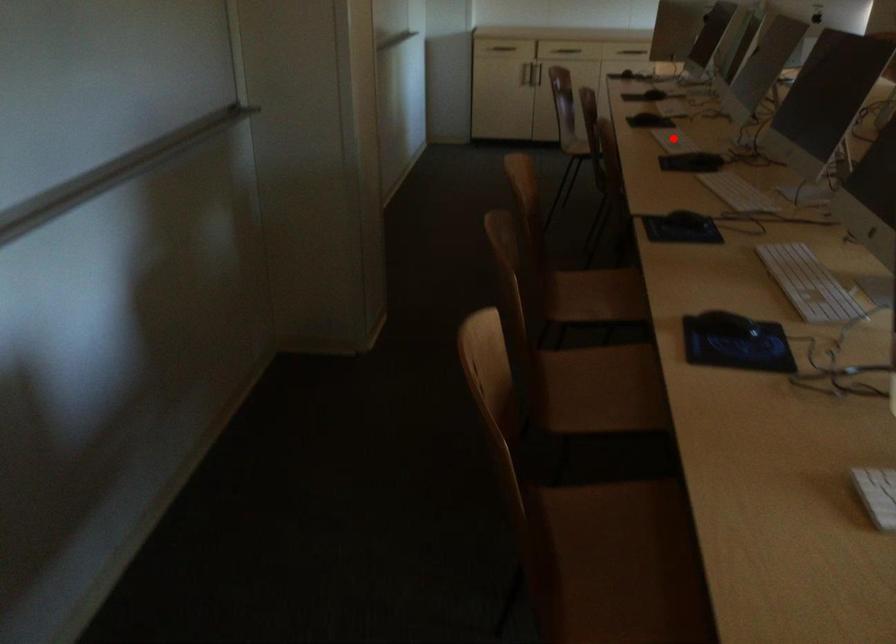
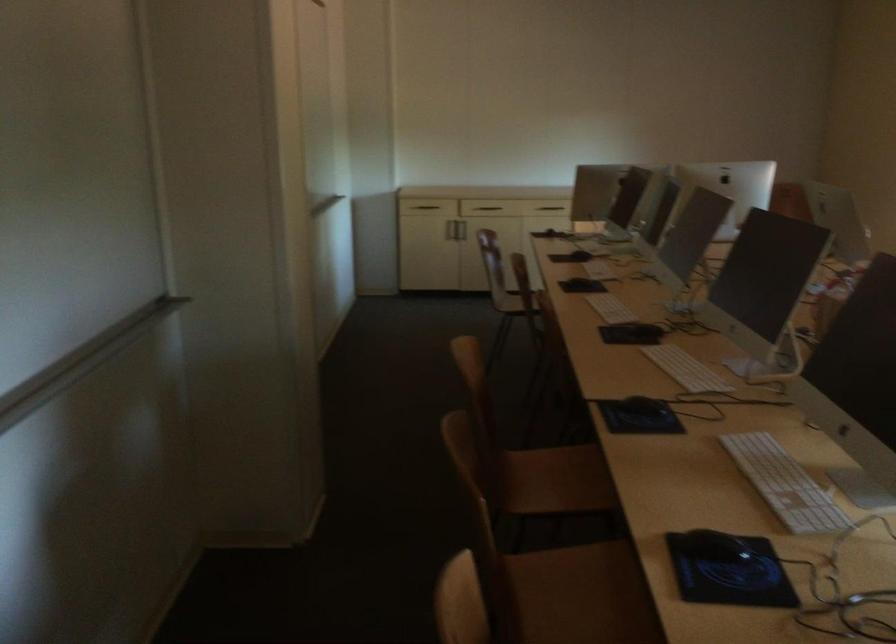
Find the pixel in the second image that matches the highlighted location in the first image.

(609, 308)